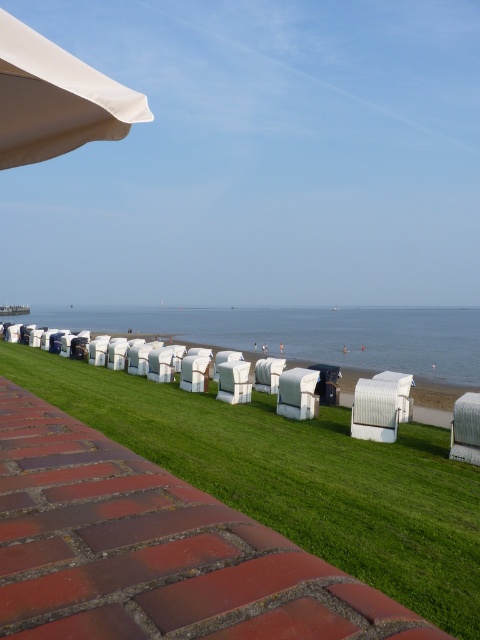
Question: Does green grass at center appear under white matte umbrella at upper left?

Choices:
 (A) no
 (B) yes

Answer: (B)

Question: Which point is farther to the camera?

Choices:
 (A) (435, 380)
 (B) (52, 113)

Answer: (A)

Question: Is blue water at center wider than white matte umbrella at upper left?

Choices:
 (A) no
 (B) yes

Answer: (B)

Question: Does green grass at center lie behind blue water at center?

Choices:
 (A) yes
 (B) no

Answer: (B)

Question: Which object is closer to the camera taking this photo?

Choices:
 (A) green grass at center
 (B) white matte umbrella at upper left
 (C) blue water at center

Answer: (B)

Question: Which of the following is the closest to the observer?

Choices:
 (A) (x=351, y=340)
 (B) (x=46, y=65)
 (C) (x=297, y=486)

Answer: (B)